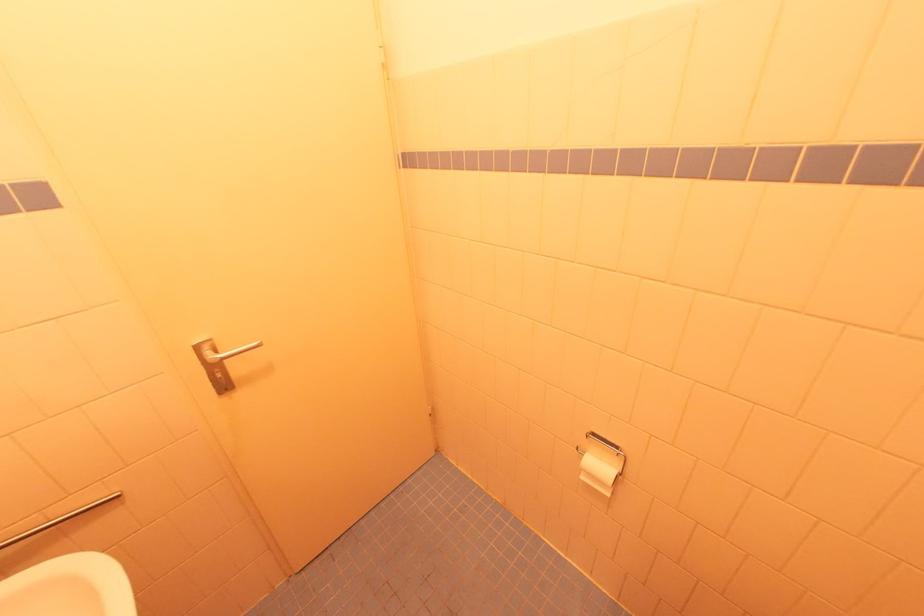
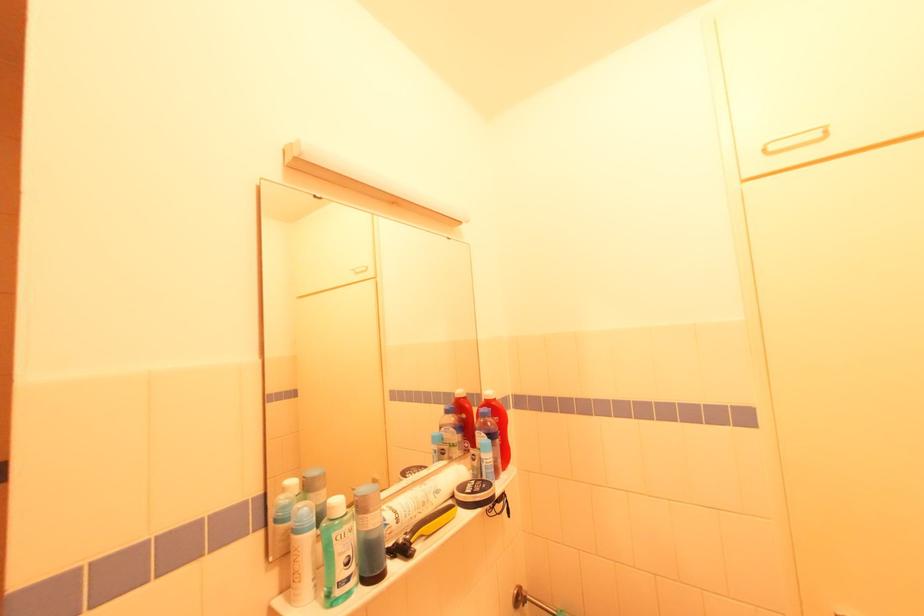
Question: How did the camera likely rotate?

Choices:
 (A) Left
 (B) Right
 (C) Up
 (D) Down

Answer: (A)